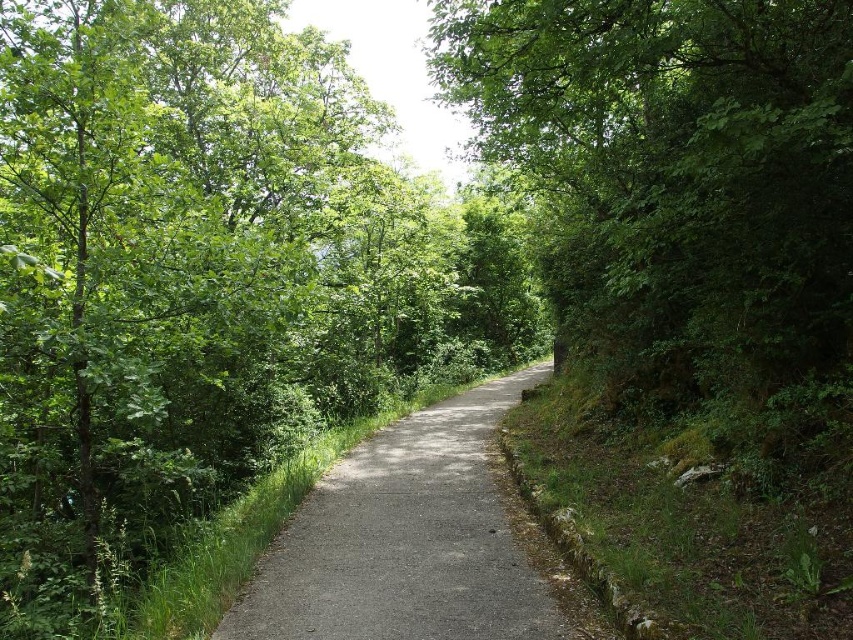
The width and height of the screenshot is (853, 640). Find the location of `green leafy tree at center`. green leafy tree at center is located at coordinates (683, 202).

Between green leafy tree at center and gray asphalt trail at center, which one appears on the left side from the viewer's perspective?

gray asphalt trail at center

Which is behind, point (496, 86) or point (393, 532)?

Positioned behind is point (496, 86).

The height and width of the screenshot is (640, 853). Find the location of `green leafy tree at center`. green leafy tree at center is located at coordinates (683, 202).